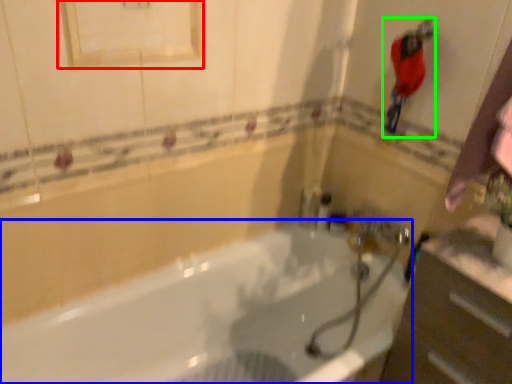
Question: Estimate the real-world distances between objects in this image. Which object is closer to medicine cabinet (highlighted by a red box), bathtub (highlighted by a blue box) or person (highlighted by a green box)?

Choices:
 (A) bathtub
 (B) person

Answer: (B)